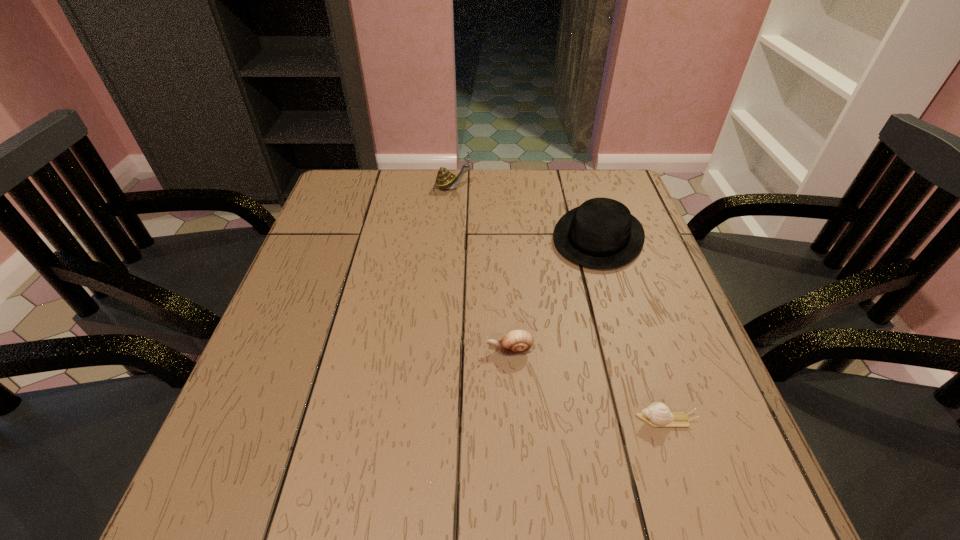
Image resolution: width=960 pixels, height=540 pixels. What are the coordinates of `object at the far right corner` in the screenshot? It's located at (601, 233).

This screenshot has height=540, width=960. In order to click on vacant space at the far edge in this screenshot , I will do `click(493, 186)`.

Locate an element on the screen. The height and width of the screenshot is (540, 960). vacant space at the left edge is located at coordinates (331, 275).

Locate an element on the screen. The width and height of the screenshot is (960, 540). vacant region at the right edge of the desktop is located at coordinates (716, 396).

The height and width of the screenshot is (540, 960). In the image, there is a desktop. What are the coordinates of `free space at the far left corner` in the screenshot? It's located at (377, 185).

Find the location of `vacant area at the near right corner`. vacant area at the near right corner is located at coordinates (709, 519).

At what (x,y) coordinates should I click in order to perform the action: click on unoccupied area between the farthest escargot and the fedora. Please return your answer as a coordinate pair (x, y). The width and height of the screenshot is (960, 540). Looking at the image, I should click on (525, 212).

This screenshot has height=540, width=960. Find the location of `vacant space that's between the second nearest escargot and the third nearest object`. vacant space that's between the second nearest escargot and the third nearest object is located at coordinates (554, 294).

This screenshot has width=960, height=540. I want to click on empty space between the leftmost object and the shortest object, so click(559, 303).

Where is `unoccupied area between the second farthest object and the leftmost escargot`? The height and width of the screenshot is (540, 960). unoccupied area between the second farthest object and the leftmost escargot is located at coordinates (525, 212).